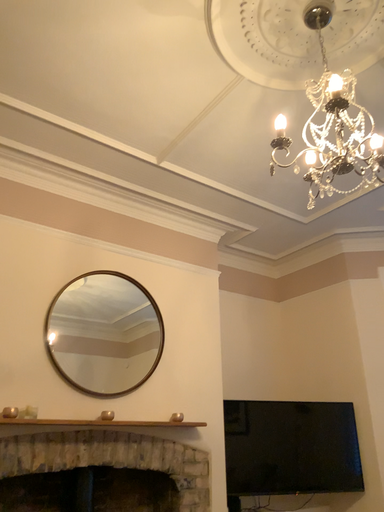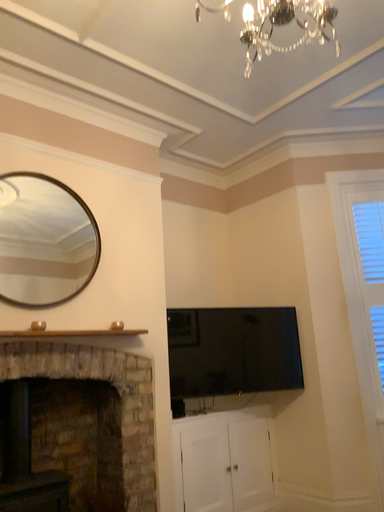
Question: How did the camera likely rotate when shooting the video?

Choices:
 (A) rotated upward
 (B) rotated downward

Answer: (B)